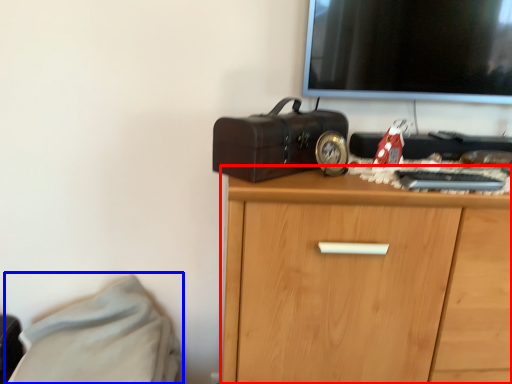
Question: Which of the following is the closest to the observer, chest of drawers (highlighted by a red box) or bed (highlighted by a blue box)?

Choices:
 (A) chest of drawers
 (B) bed

Answer: (A)